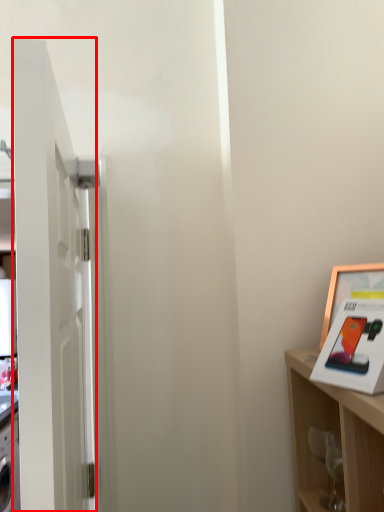
Question: From the image's perspective, what is the correct spatial positioning of door (annotated by the red box) in reference to picture frame?

Choices:
 (A) above
 (B) below

Answer: (B)